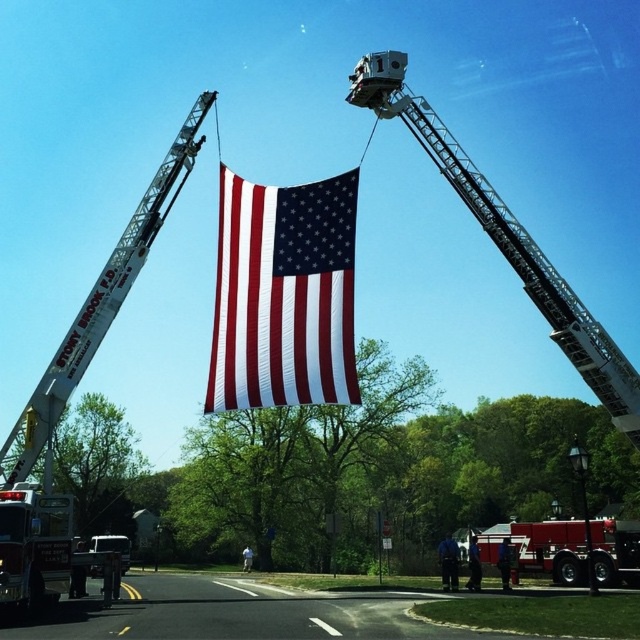
You are a photographer wanting to capture the American flag between the two fire apparatus. Which one of the two metallic silver structures, the metallic silver ladder at upper center or the metallic silver lift at center, is taller to ensure the flag is properly framed?

The metallic silver ladder at upper center is taller than the metallic silver lift at center, so positioning the camera to focus on the ladder will ensure the flag is properly framed.

You are a photographer planning to capture a wide shot of the scene. Considering the white metallic fire truck at left and the metallic silver lift at center, which object should you position closer to the camera to ensure both fit within the frame without cropping?

You should position the white metallic fire truck at left closer to the camera because it is wider than the metallic silver lift at center, allowing both objects to fit within the frame without cropping.